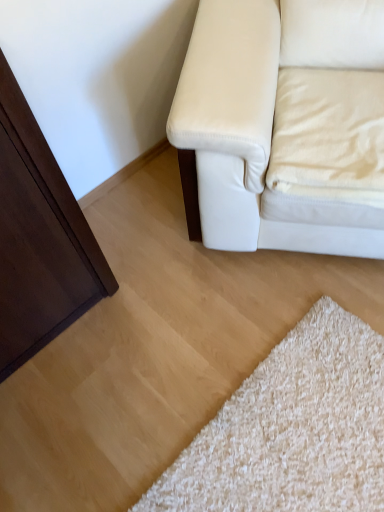
Question: From the image's perspective, is matte white leather couch at upper right positioned above or below beige fabric pillow at upper right?

Choices:
 (A) below
 (B) above

Answer: (B)

Question: Is matte white leather couch at upper right in front of or behind beige fabric pillow at upper right in the image?

Choices:
 (A) front
 (B) behind

Answer: (A)

Question: Is matte white leather couch at upper right bigger or smaller than beige fabric pillow at upper right?

Choices:
 (A) small
 (B) big

Answer: (B)

Question: Choose the correct answer: Is beige fabric pillow at upper right inside matte white leather couch at upper right or outside it?

Choices:
 (A) outside
 (B) inside

Answer: (B)

Question: Considering the positions of beige fabric pillow at upper right and matte white leather couch at upper right in the image, is beige fabric pillow at upper right wider or thinner than matte white leather couch at upper right?

Choices:
 (A) wide
 (B) thin

Answer: (B)

Question: From the image's perspective, relative to matte white leather couch at upper right, is beige fabric pillow at upper right above or below?

Choices:
 (A) above
 (B) below

Answer: (B)

Question: From a real-world perspective, is beige fabric pillow at upper right positioned above or below matte white leather couch at upper right?

Choices:
 (A) below
 (B) above

Answer: (A)